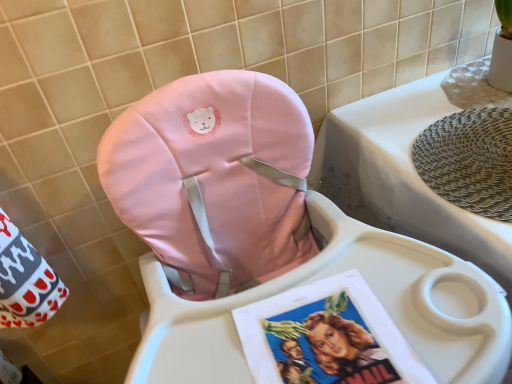
Question: Considering the positions of white plastic changing table at upper right and matte pink cushion at center in the image, is white plastic changing table at upper right bigger or smaller than matte pink cushion at center?

Choices:
 (A) big
 (B) small

Answer: (B)

Question: Is white plastic changing table at upper right spatially inside matte pink cushion at center, or outside of it?

Choices:
 (A) inside
 (B) outside

Answer: (B)

Question: Is white plastic changing table at upper right wider or thinner than matte pink cushion at center?

Choices:
 (A) thin
 (B) wide

Answer: (A)

Question: Is point (259, 291) positioned closer to the camera than point (361, 178)?

Choices:
 (A) farther
 (B) closer

Answer: (B)

Question: Is matte pink cushion at center to the left or to the right of white plastic changing table at upper right in the image?

Choices:
 (A) right
 (B) left

Answer: (B)

Question: From a real-world perspective, is matte pink cushion at center above or below white plastic changing table at upper right?

Choices:
 (A) below
 (B) above

Answer: (B)

Question: Considering the positions of matte pink cushion at center and white plastic changing table at upper right in the image, is matte pink cushion at center wider or thinner than white plastic changing table at upper right?

Choices:
 (A) thin
 (B) wide

Answer: (B)